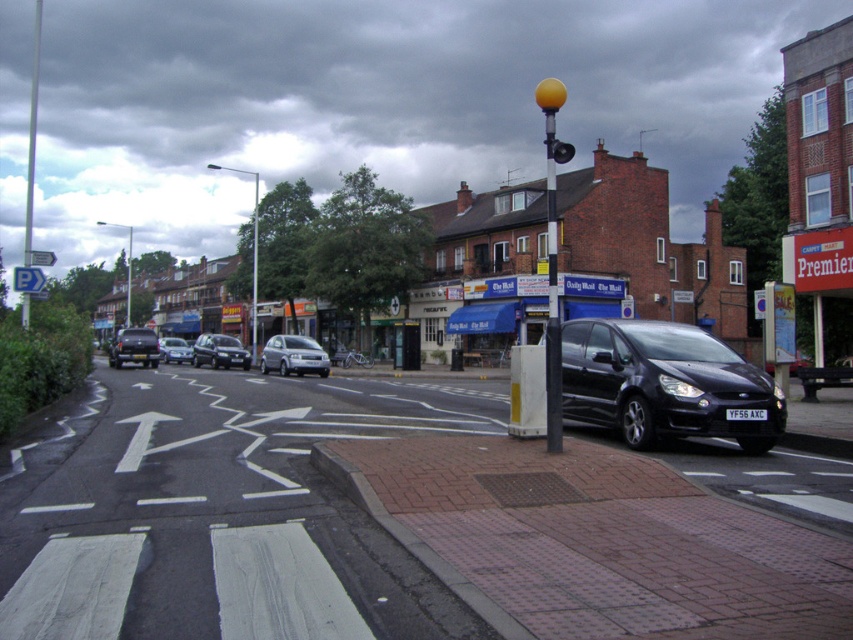
You are a delivery driver who needs to stop at the yellow matte traffic light at upper center. According to the coordinates given, where should you position your vehicle to ensure you are directly in front of the traffic light?

The yellow matte traffic light at upper center is located at coordinates point (560, 150). To position your vehicle directly in front of it, align your vehicle with the coordinates provided so that you are facing the traffic light at that exact point.

You are standing at the lamppost with the spherical yellow light fixture on the sidewalk. You see two points marked on the ground in front of you. The first point is at coordinates point (132,349) and the second point is at point (561,160). Which point is closer to you?

Result: Point (132,349) is further to the camera than point (561,160). Therefore, the point closer to you is point (561,160).